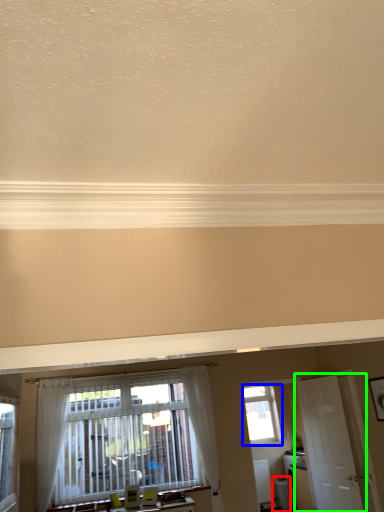
Question: Which is nearer to the appliance (highlighted by a red box)? window (highlighted by a blue box) or door (highlighted by a green box).

Choices:
 (A) window
 (B) door

Answer: (A)